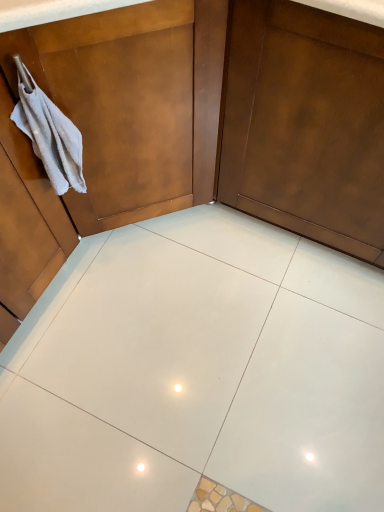
I want to click on empty space that is ontop of white glossy tile at center, so click(x=206, y=357).